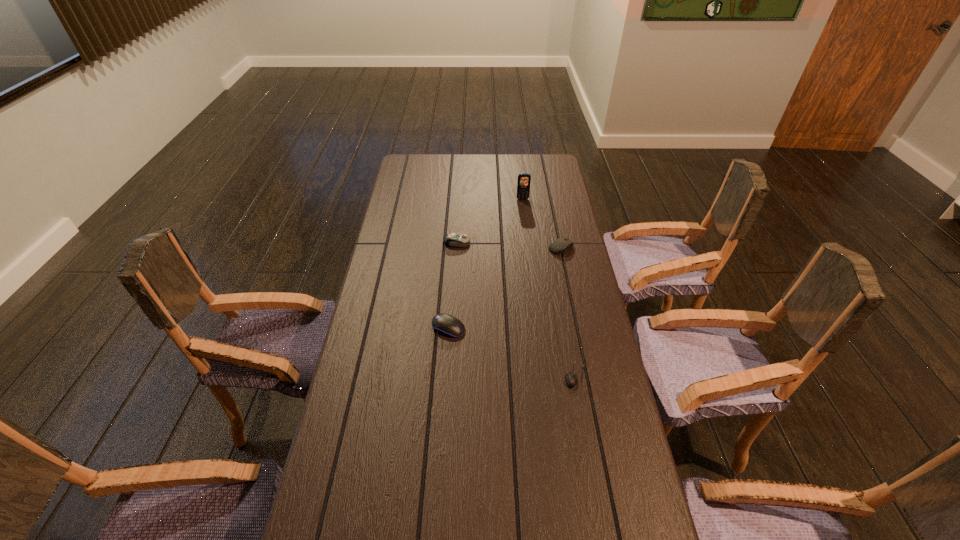
Locate an element on the screen. Image resolution: width=960 pixels, height=540 pixels. free region at the far left corner of the desktop is located at coordinates (401, 159).

Where is `free space between the cellular telephone and the shortest mouse`? This screenshot has height=540, width=960. free space between the cellular telephone and the shortest mouse is located at coordinates tap(549, 288).

This screenshot has height=540, width=960. I want to click on vacant space that is in between the cellular telephone and the third farthest mouse, so click(x=486, y=264).

The image size is (960, 540). I want to click on free space between the shortest mouse and the second nearest object, so click(x=513, y=352).

This screenshot has height=540, width=960. Identify the location of the second closest object to the second nearest object. (451, 239).

The width and height of the screenshot is (960, 540). In order to click on the third closest object to the cellular telephone in this screenshot , I will do `click(445, 324)`.

Choose which mouse is the second nearest neighbor to the shortest object. Please provide its 2D coordinates. Your answer should be formatted as a tuple, i.e. [(x, y)], where the tuple contains the x and y coordinates of a point satisfying the conditions above.

[(562, 244)]

Find the location of `mouse that is the third nearest to the cellular telephone`. mouse that is the third nearest to the cellular telephone is located at coordinates (445, 324).

I want to click on vacant region that satisfies the following two spatial constraints: 1. on the front side of the second nearest mouse; 2. on the right side of the nearest object, so click(445, 376).

This screenshot has width=960, height=540. In order to click on vacant area that satisfies the following two spatial constraints: 1. on the screen of the farthest object; 2. on the right side of the shortest mouse in this screenshot , I will do `click(544, 376)`.